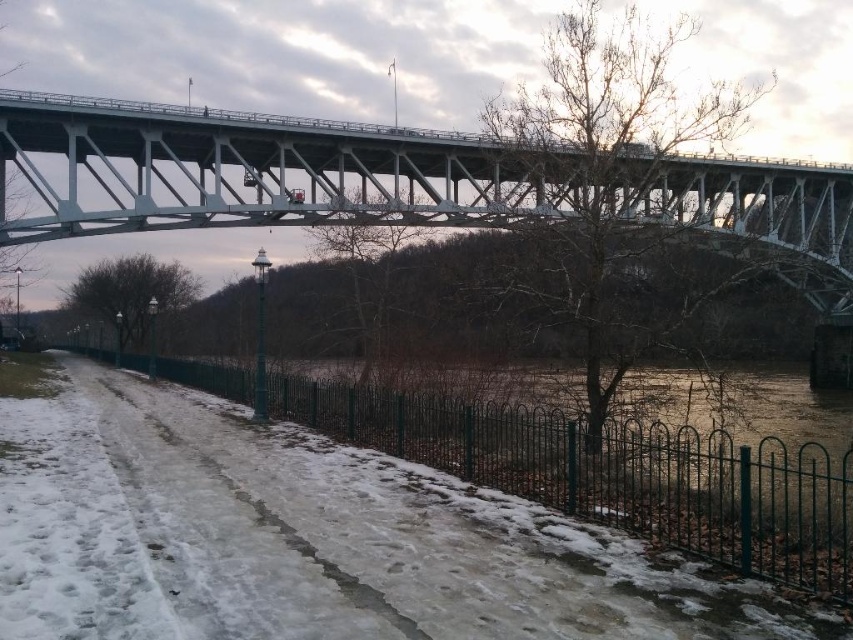
Question: Is the position of white powdery snow at lower left more distant than that of white metallic bridge at upper center?

Choices:
 (A) no
 (B) yes

Answer: (A)

Question: Among these objects, which one is farthest from the camera?

Choices:
 (A) white metallic bridge at upper center
 (B) white powdery snow at lower left

Answer: (A)

Question: Which of the following is the farthest from the observer?

Choices:
 (A) white metallic bridge at upper center
 (B) white powdery snow at lower left

Answer: (A)

Question: Is white powdery snow at lower left further to the viewer compared to white metallic bridge at upper center?

Choices:
 (A) yes
 (B) no

Answer: (B)

Question: In this image, where is white powdery snow at lower left located relative to white metallic bridge at upper center?

Choices:
 (A) left
 (B) right

Answer: (A)